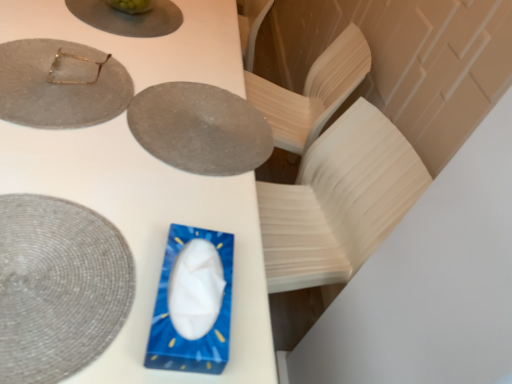
Identify the location of free space above matte gray placemat at upper left, acting as the 2th plate starting from the top (from a real-world perspective). (55, 72).